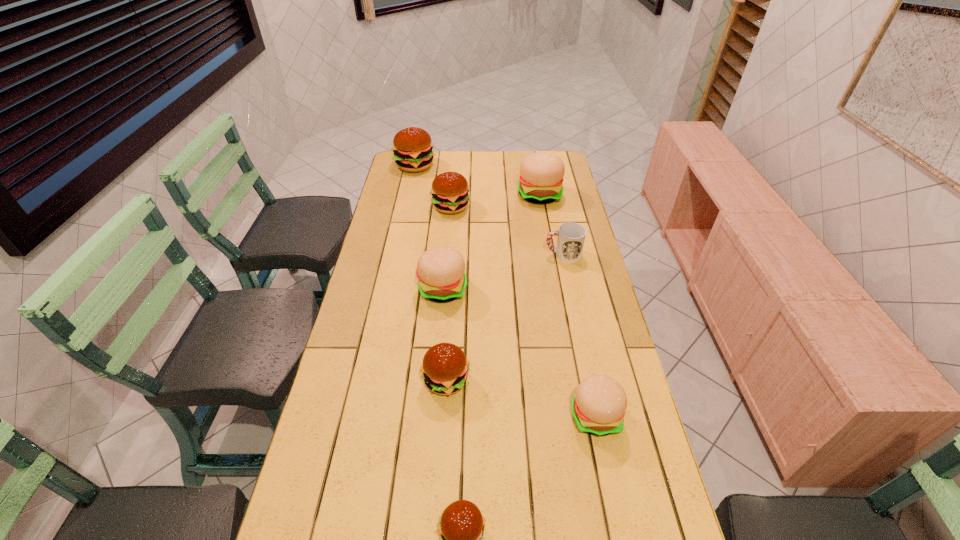
The height and width of the screenshot is (540, 960). I want to click on object at the left edge, so click(x=412, y=147).

Find the location of a particular element. The image size is (960, 540). cup located at the right edge is located at coordinates (571, 236).

In order to click on object that is at the far left corner in this screenshot , I will do `click(412, 147)`.

The width and height of the screenshot is (960, 540). I want to click on vacant space at the far edge of the desktop, so click(462, 153).

Find the location of a particular element. The height and width of the screenshot is (540, 960). free space at the left edge of the desktop is located at coordinates (332, 495).

Find the location of a particular element. vacant space at the far left corner of the desktop is located at coordinates (406, 176).

The image size is (960, 540). Find the location of `vacant area that lies between the third biggest brown hamburger and the biggest beige hamburger`. vacant area that lies between the third biggest brown hamburger and the biggest beige hamburger is located at coordinates (492, 288).

Locate an element on the screen. Image resolution: width=960 pixels, height=540 pixels. free space that is in between the third nearest brown hamburger and the biggest beige hamburger is located at coordinates (495, 201).

Image resolution: width=960 pixels, height=540 pixels. Identify the location of free point between the cup and the second farthest beige hamburger. (503, 272).

Where is `the seventh closest object to the farthest brown hamburger`? the seventh closest object to the farthest brown hamburger is located at coordinates (461, 527).